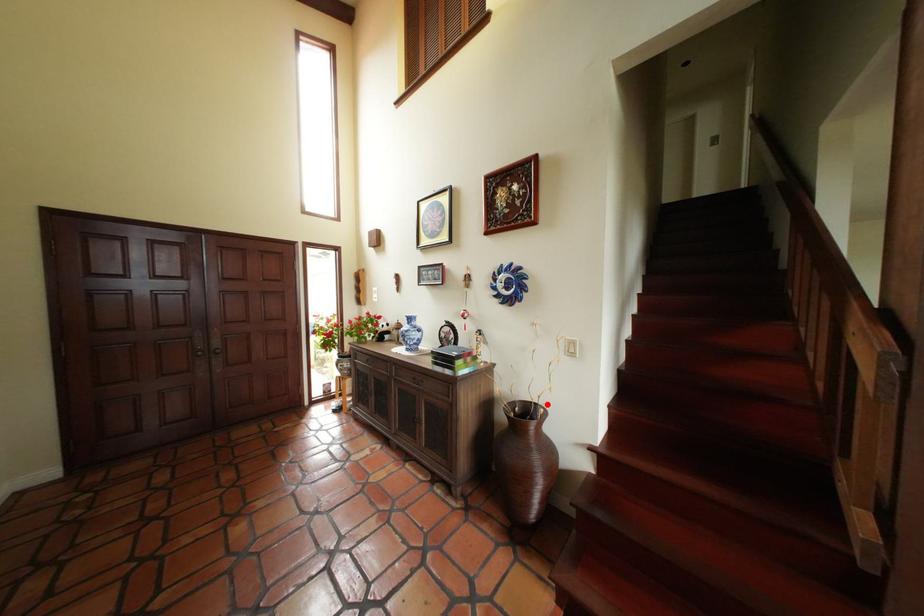
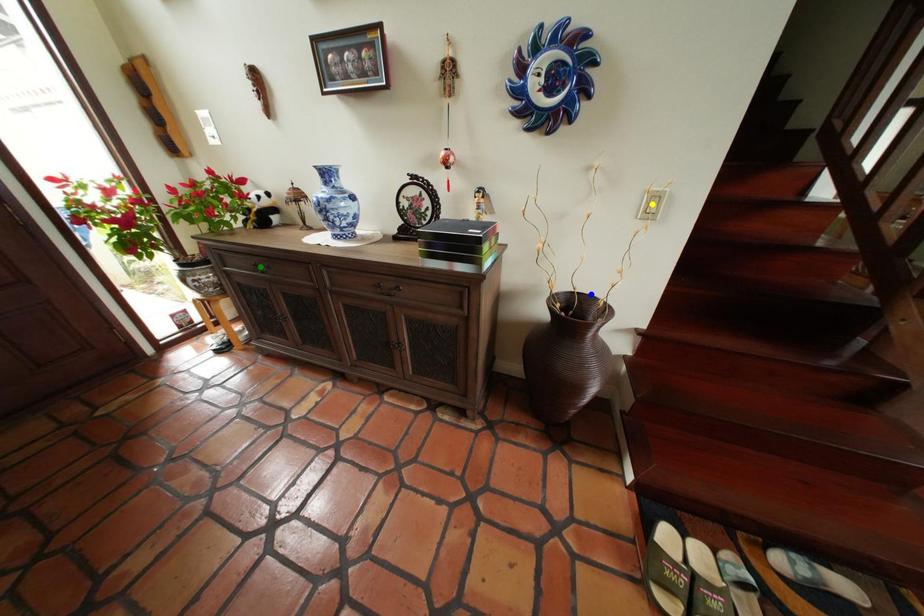
Question: I am providing you with two images of the same scene from different viewpoints. A red point is marked on the first image. You are given multiple points on the second image. Which point in image 2 represents the same 3d spot as the red point in image 1?

Choices:
 (A) green point
 (B) yellow point
 (C) blue point

Answer: (C)